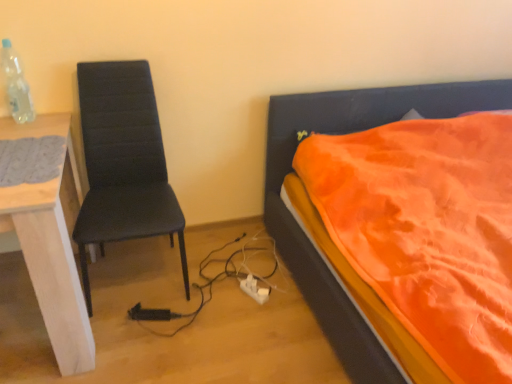
Where is `unoccupied region to the right of white plastic power plugs and sockets at lower center`? unoccupied region to the right of white plastic power plugs and sockets at lower center is located at coordinates (285, 297).